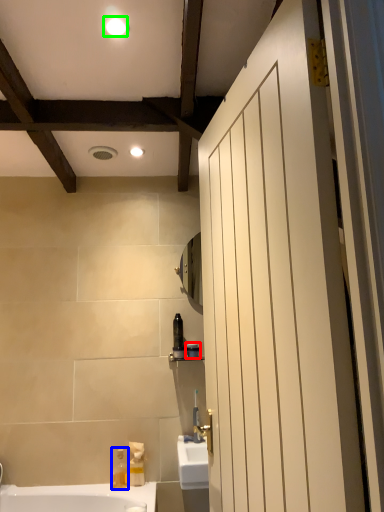
Question: Which object is the closest to the toiletry (highlighted by a red box)? Choose among these: soap dispenser (highlighted by a blue box) or light fixture (highlighted by a green box).

Choices:
 (A) soap dispenser
 (B) light fixture

Answer: (A)